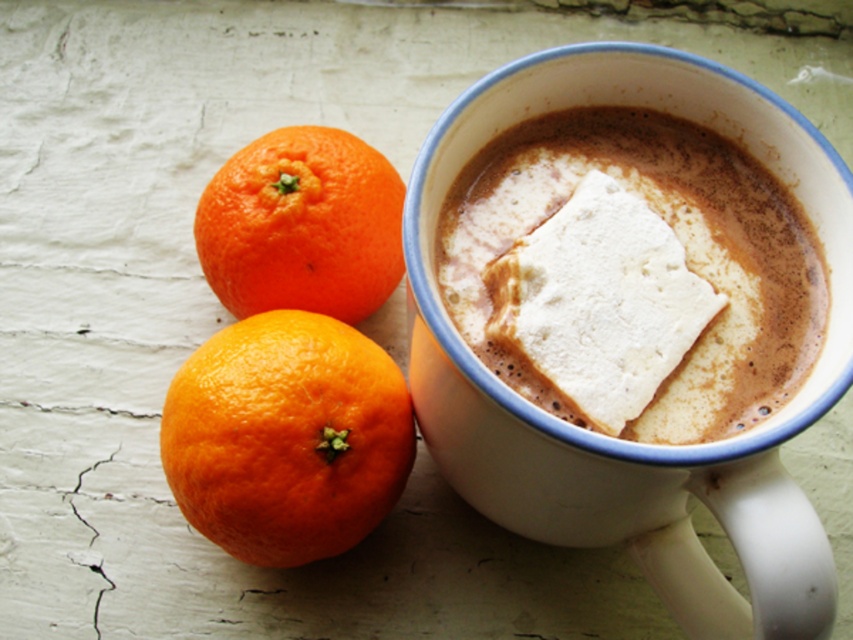
Identify the location of white fluffy marshmallow in the cup at center. (677, 240).

Who is taller, white fluffy marshmallow in the cup at center or orangesmoothfruit at left?

With more height is white fluffy marshmallow in the cup at center.

Find the location of a particular element. Image resolution: width=853 pixels, height=640 pixels. white fluffy marshmallow in the cup at center is located at coordinates (677, 240).

Does orangesmoothfruit at left appear on the right side of orangesmoothorange at left?

Correct, you'll find orangesmoothfruit at left to the right of orangesmoothorange at left.

This screenshot has width=853, height=640. What do you see at coordinates (286, 436) in the screenshot?
I see `orangesmoothfruit at left` at bounding box center [286, 436].

This screenshot has width=853, height=640. In order to click on orangesmoothfruit at left in this screenshot , I will do point(286,436).

This screenshot has width=853, height=640. In order to click on orangesmoothfruit at left in this screenshot , I will do `click(286, 436)`.

In the scene shown: Can you confirm if white fluffy marshmallow in the cup at center is smaller than orangesmoothorange at left?

Actually, white fluffy marshmallow in the cup at center might be larger than orangesmoothorange at left.

Between point (704, 333) and point (328, 218), which one is positioned in front?

Point (704, 333) is more forward.

The height and width of the screenshot is (640, 853). Identify the location of white fluffy marshmallow in the cup at center. (677, 240).